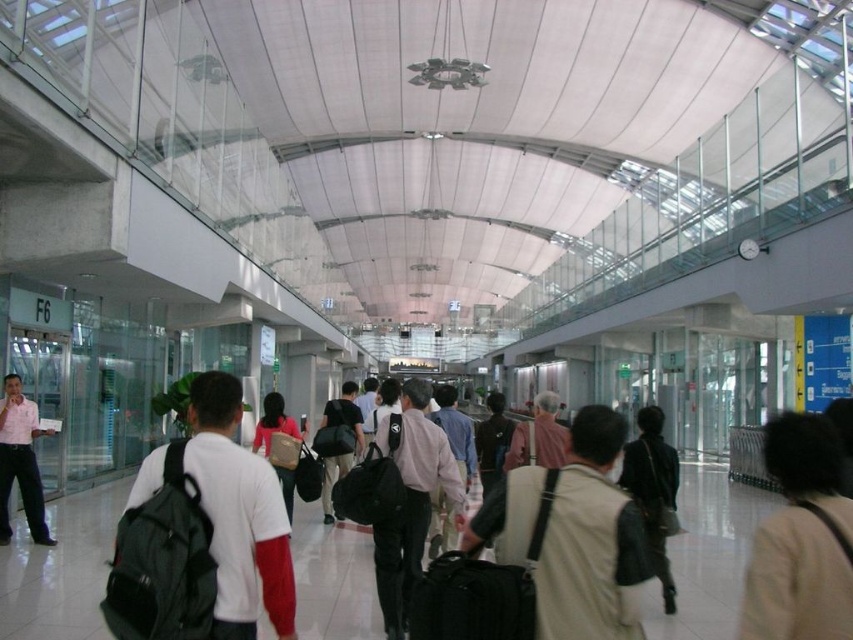
You are standing at the camera position in the airport terminal and see the black matte backpack at center. If you want to pick it up, how many steps do you need to take forward?

The black matte backpack at center is 3.43 meters away from camera. Assuming an average step length of 0.75 meters, you would need to take approximately 5 steps forward to reach it.

Consider the image. You are a traveler at the airport terminal and you see a beige fabric coat at lower right and a matte black backpack at center. Which item takes up more space in your luggage compartment?

The beige fabric coat at lower right is larger in size than the matte black backpack at center, so it will take up more space in your luggage compartment.

You are a traveler at the airport and need to place your matte black backpack at center and black fabric suitcase at center into an overhead compartment. The compartment has a maximum weight limit of 22 pounds. If the backpack weighs 18 pounds and the suitcase weighs 20 pounds, can both items be safely stored in the compartment without exceeding the weight limit?

The matte black backpack at center weighs 18 pounds and the black fabric suitcase at center weighs 20 pounds. Combined, they total 38 pounds, which exceeds the 22 pound limit. Therefore, both items cannot be safely stored in the compartment together.